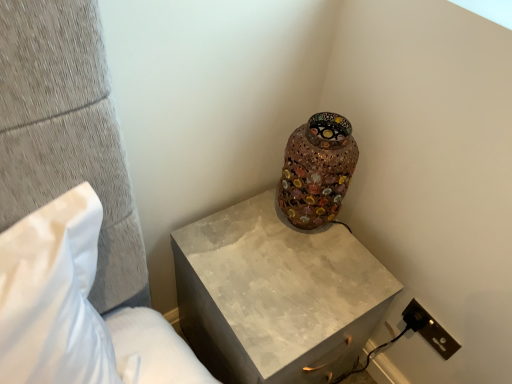
This screenshot has width=512, height=384. I want to click on unoccupied area in front of mosaic glass vase at upper right, so click(301, 276).